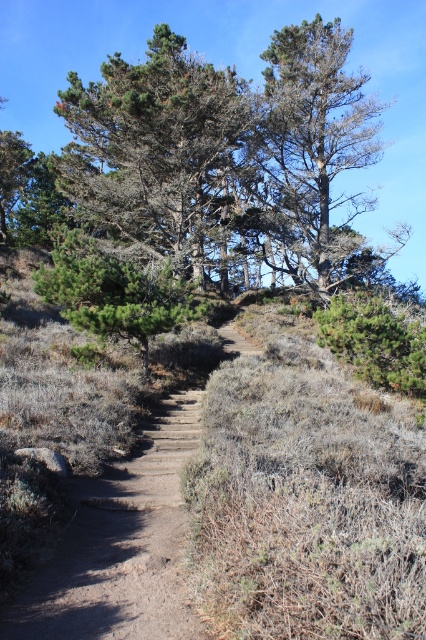
You are standing at the point marked as point (137, 90) and want to walk to the base of the nearest tall coniferous tree. How far will you have to walk?

The distance between you and the nearest tall coniferous tree is 17.87 meters, so you will have to walk 17.87 meters to reach its base.